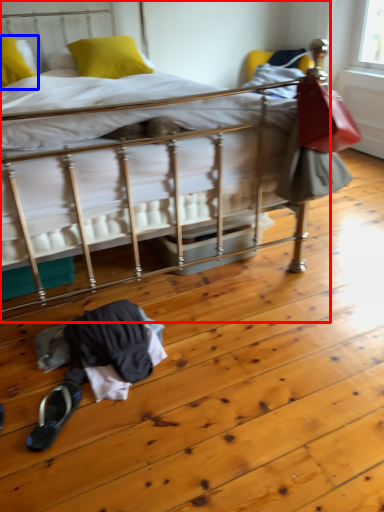
Question: Which point is further to the camera, bed (highlighted by a red box) or pillow (highlighted by a blue box)?

Choices:
 (A) bed
 (B) pillow

Answer: (B)